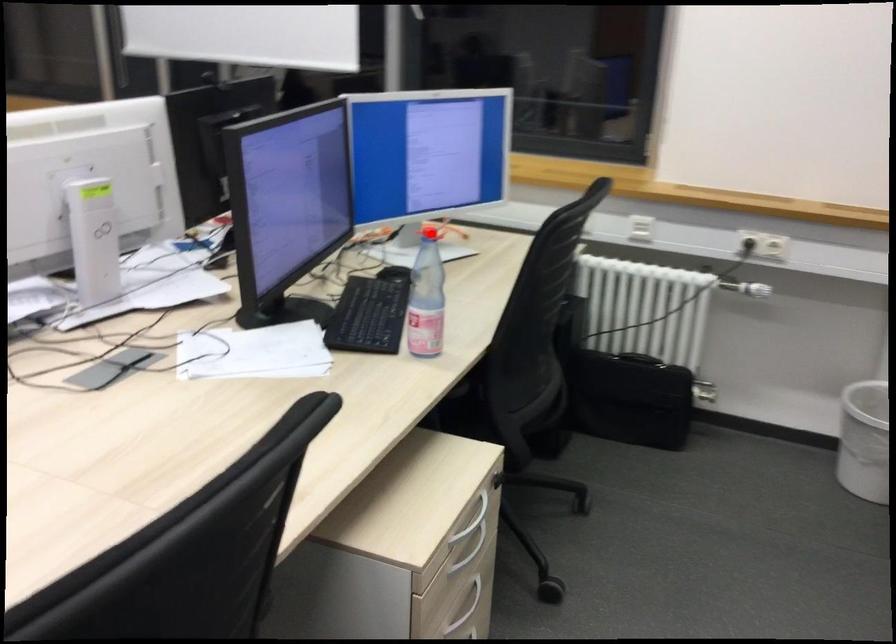
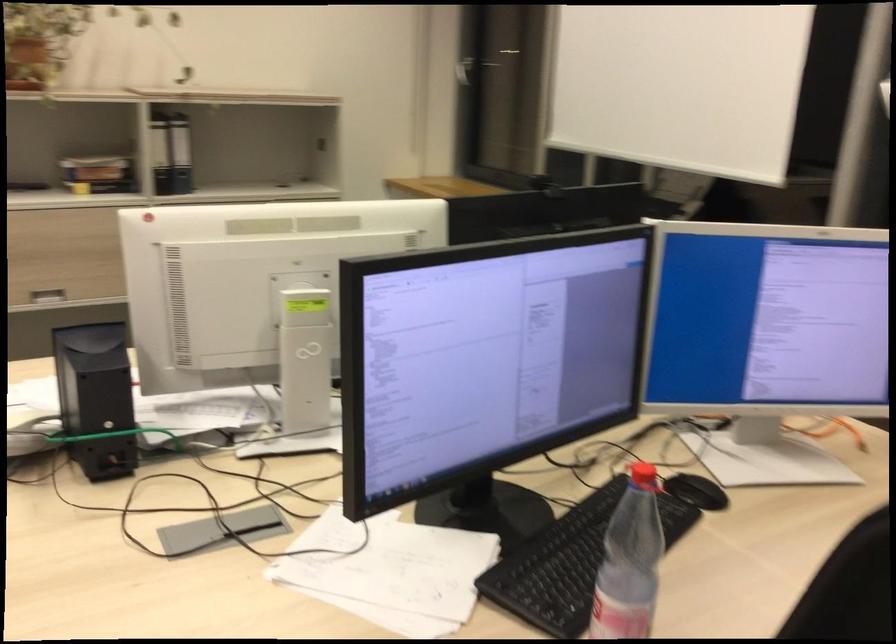
The point at the highlighted location is marked in the first image. Where is the corresponding point in the second image?

(642, 478)